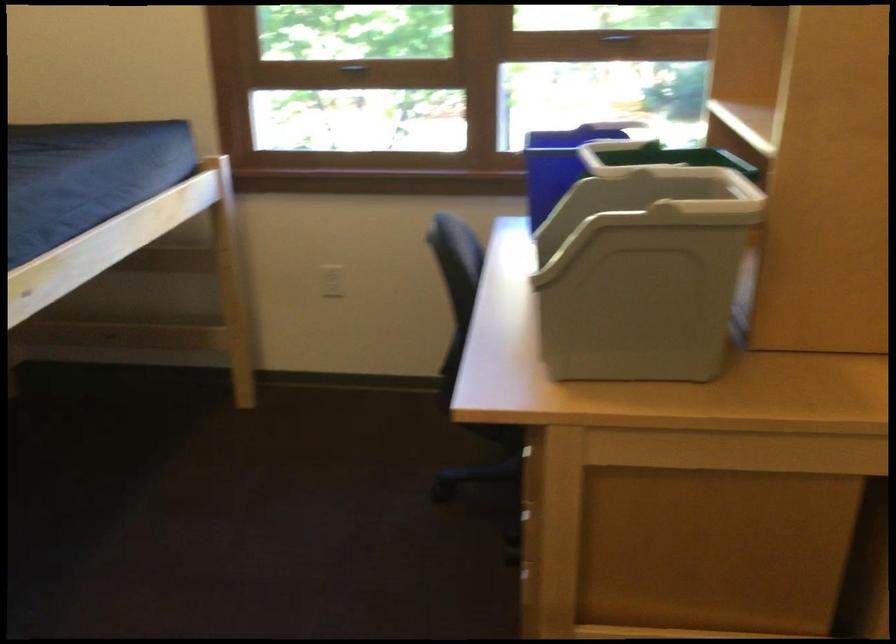
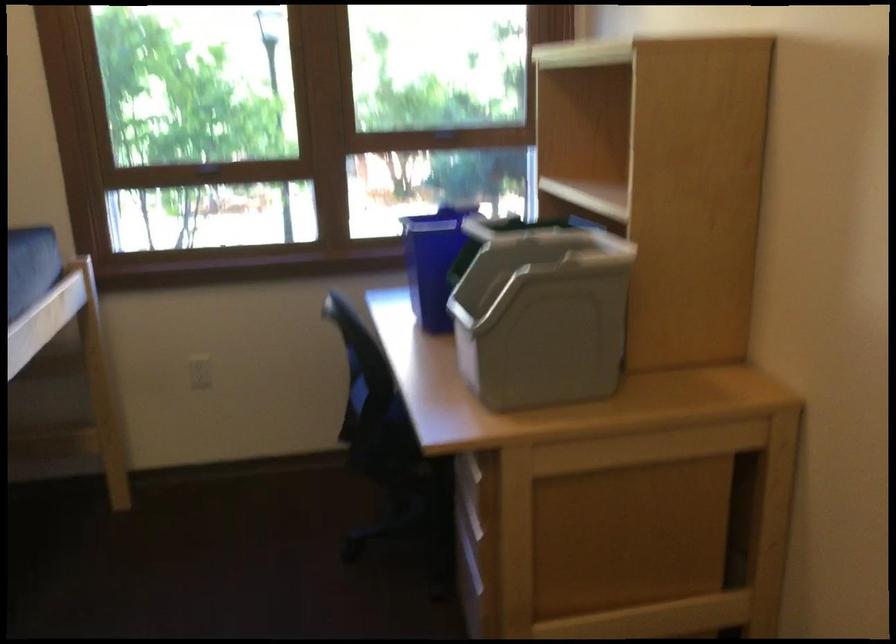
Find the pixel in the second image that matches (545,191) in the first image.

(433, 261)